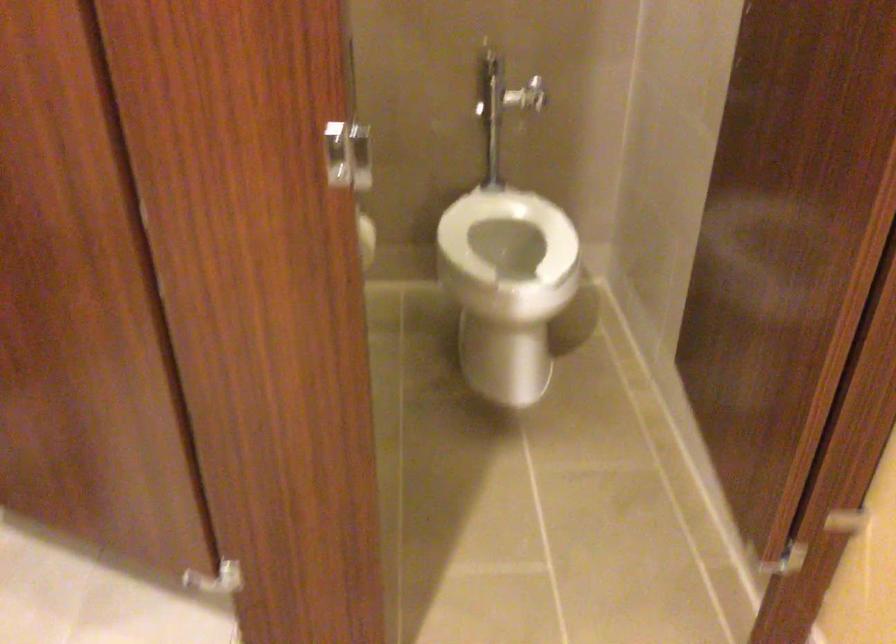
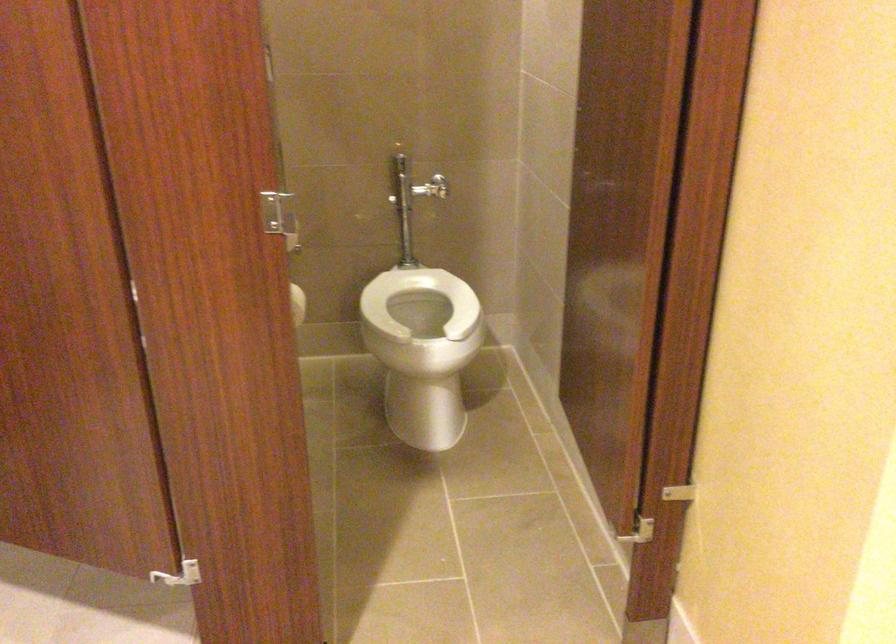
Find the pixel in the second image that matches point 505,228 in the first image.

(419, 301)